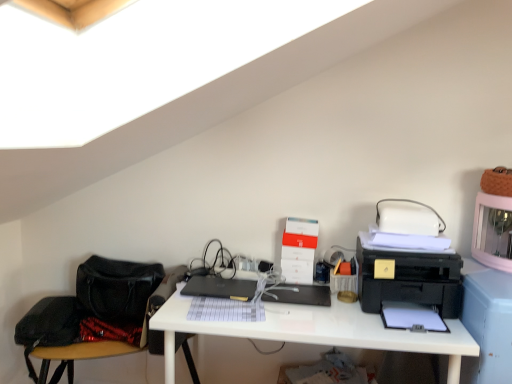
Identify the location of free space on the front side of black plastic printer at right. This screenshot has height=384, width=512. 415,331.